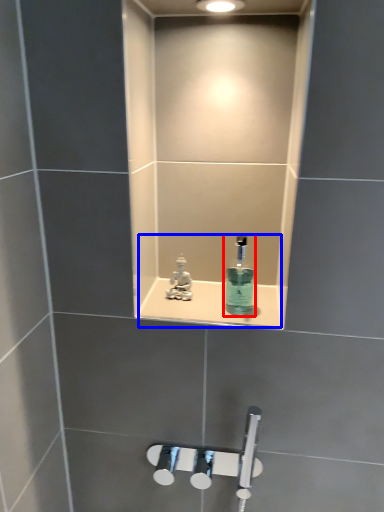
Question: Which of the following is the farthest to the observer, mouthwash (highlighted by a red box) or sink (highlighted by a blue box)?

Choices:
 (A) mouthwash
 (B) sink

Answer: (B)